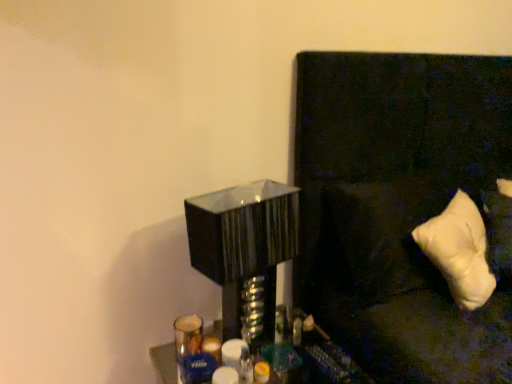
Question: In the image, is white soft pillow at right positioned in front of or behind glossy black table lamp at center?

Choices:
 (A) front
 (B) behind

Answer: (B)

Question: In terms of height, does white soft pillow at right look taller or shorter compared to glossy black table lamp at center?

Choices:
 (A) short
 (B) tall

Answer: (A)

Question: Which is nearer to the white soft pillow at right?

Choices:
 (A) white soft pillow at right
 (B) metallic silver tray at lower center
 (C) glossy black table lamp at center

Answer: (A)

Question: Based on their relative distances, which object is farther from the white soft pillow at right?

Choices:
 (A) glossy black table lamp at center
 (B) white soft pillow at right
 (C) metallic silver tray at lower center

Answer: (C)